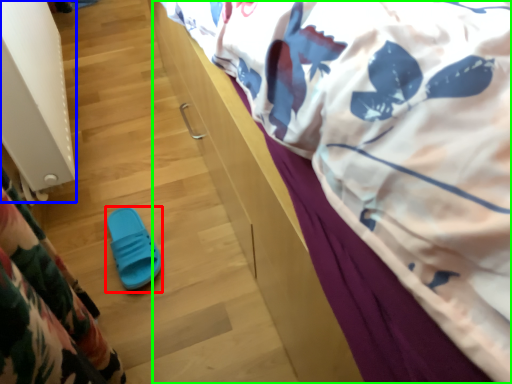
Question: Estimate the real-world distances between objects in this image. Which object is farther from footwear (highlighted by a red box), radiator (highlighted by a blue box) or bed (highlighted by a green box)?

Choices:
 (A) radiator
 (B) bed

Answer: (B)